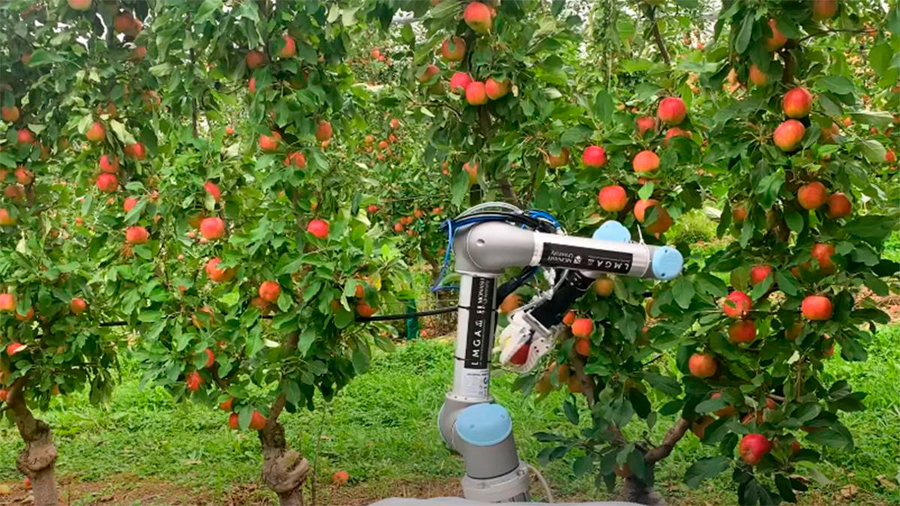
Identify the location of wires. The width and height of the screenshot is (900, 506). (538, 226), (446, 240), (528, 210), (510, 209), (424, 313), (508, 285), (546, 487).